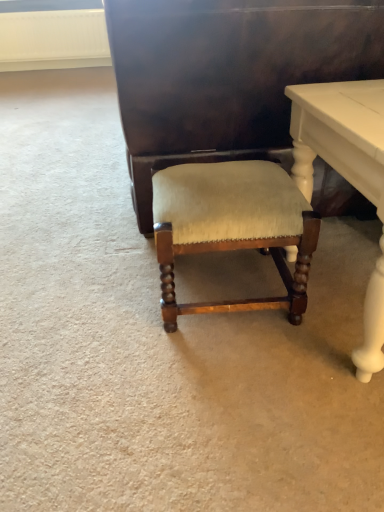
Question: Is shiny dark wood vanity at center thinner than white glossy table at lower right?

Choices:
 (A) yes
 (B) no

Answer: (B)

Question: Can we say shiny dark wood vanity at center lies outside white glossy table at lower right?

Choices:
 (A) no
 (B) yes

Answer: (B)

Question: Can you confirm if shiny dark wood vanity at center is positioned to the left of white glossy table at lower right?

Choices:
 (A) yes
 (B) no

Answer: (A)

Question: Does shiny dark wood vanity at center have a larger size compared to white glossy table at lower right?

Choices:
 (A) yes
 (B) no

Answer: (A)

Question: From the image's perspective, would you say shiny dark wood vanity at center is shown under white glossy table at lower right?

Choices:
 (A) no
 (B) yes

Answer: (A)

Question: Relative to suede-like beige cushion at center, is white glossy table at lower right in front or behind?

Choices:
 (A) front
 (B) behind

Answer: (A)

Question: Looking at their shapes, would you say white glossy table at lower right is wider or thinner than suede-like beige cushion at center?

Choices:
 (A) thin
 (B) wide

Answer: (B)

Question: Considering the positions of point (362, 182) and point (268, 165), is point (362, 182) closer or farther from the camera than point (268, 165)?

Choices:
 (A) closer
 (B) farther

Answer: (A)

Question: Considering the positions of white glossy table at lower right and suede-like beige cushion at center in the image, is white glossy table at lower right bigger or smaller than suede-like beige cushion at center?

Choices:
 (A) big
 (B) small

Answer: (A)

Question: Considering the positions of shiny dark wood vanity at center and white glossy table at lower right in the image, is shiny dark wood vanity at center bigger or smaller than white glossy table at lower right?

Choices:
 (A) big
 (B) small

Answer: (A)

Question: Relative to white glossy table at lower right, is shiny dark wood vanity at center in front or behind?

Choices:
 (A) front
 (B) behind

Answer: (B)

Question: From a real-world perspective, relative to white glossy table at lower right, is shiny dark wood vanity at center vertically above or below?

Choices:
 (A) below
 (B) above

Answer: (B)

Question: Based on their positions, is shiny dark wood vanity at center located to the left or right of white glossy table at lower right?

Choices:
 (A) left
 (B) right

Answer: (A)

Question: Is suede-like beige cushion at center to the left or to the right of white glossy table at lower right in the image?

Choices:
 (A) left
 (B) right

Answer: (A)

Question: Is suede-like beige cushion at center in front of or behind white glossy table at lower right in the image?

Choices:
 (A) behind
 (B) front

Answer: (A)